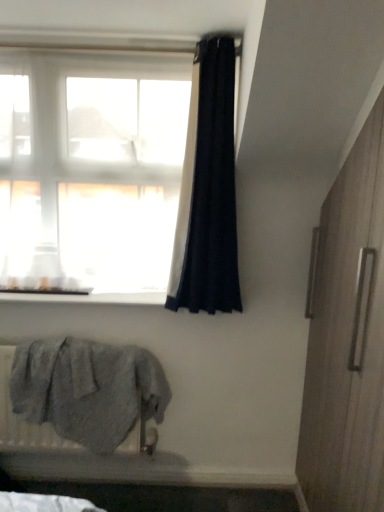
Where is `free space above translucent white curtain at upper left (from a real-world perspective)`? free space above translucent white curtain at upper left (from a real-world perspective) is located at coordinates (85, 34).